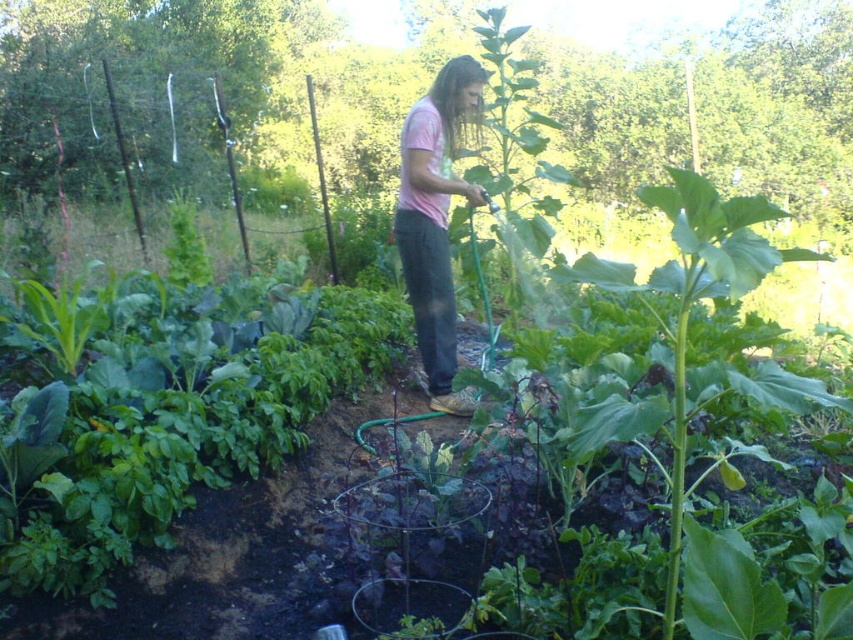
Does green leafy vegetables at center have a larger size compared to pink matte shirt at center?

Yes.

Who is more distant from viewer, [242,442] or [448,129]?

The point [448,129] is more distant.

Where is `green leafy vegetables at center`? The width and height of the screenshot is (853, 640). green leafy vegetables at center is located at coordinates (178, 426).